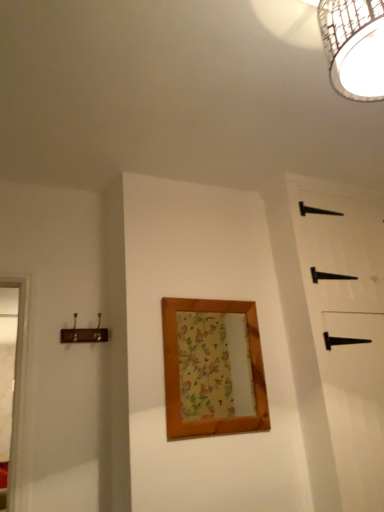
Question: Looking at their shapes, would you say wooden framed mirror at center is wider or thinner than black matte barn door at right?

Choices:
 (A) thin
 (B) wide

Answer: (A)

Question: Relative to black matte barn door at right, is wooden framed mirror at center in front or behind?

Choices:
 (A) behind
 (B) front

Answer: (A)

Question: Which object is positioned farthest from the woven bamboo light fixture at upper right?

Choices:
 (A) white wood window frame at left
 (B) black matte barn door at right
 (C) wooden framed mirror at center

Answer: (A)

Question: Based on their relative distances, which object is nearer to the woven bamboo light fixture at upper right?

Choices:
 (A) black matte barn door at right
 (B) white wood window frame at left
 (C) wooden framed mirror at center

Answer: (A)